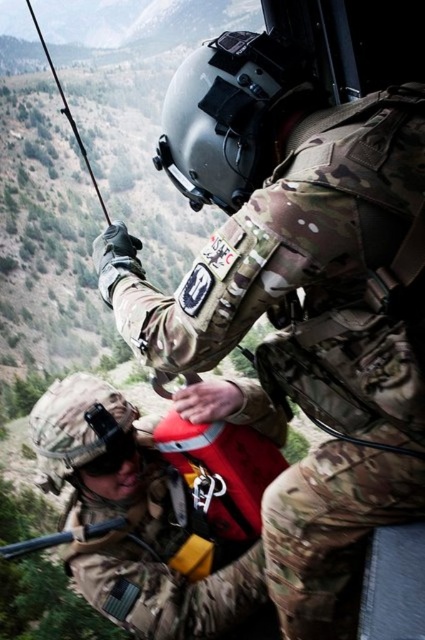
Question: Can you confirm if camouflage uniform at center is positioned below matte black rifle at center?

Choices:
 (A) yes
 (B) no

Answer: (B)

Question: Which point is closer to the camera taking this photo?

Choices:
 (A) (274, 273)
 (B) (11, 545)

Answer: (A)

Question: Does camouflage uniform at center appear under matte black rifle at center?

Choices:
 (A) yes
 (B) no

Answer: (B)

Question: Does camouflage uniform at center appear under matte black rifle at center?

Choices:
 (A) yes
 (B) no

Answer: (B)

Question: Among these points, which one is farthest from the camera?

Choices:
 (A) (27, 541)
 (B) (368, 198)

Answer: (A)